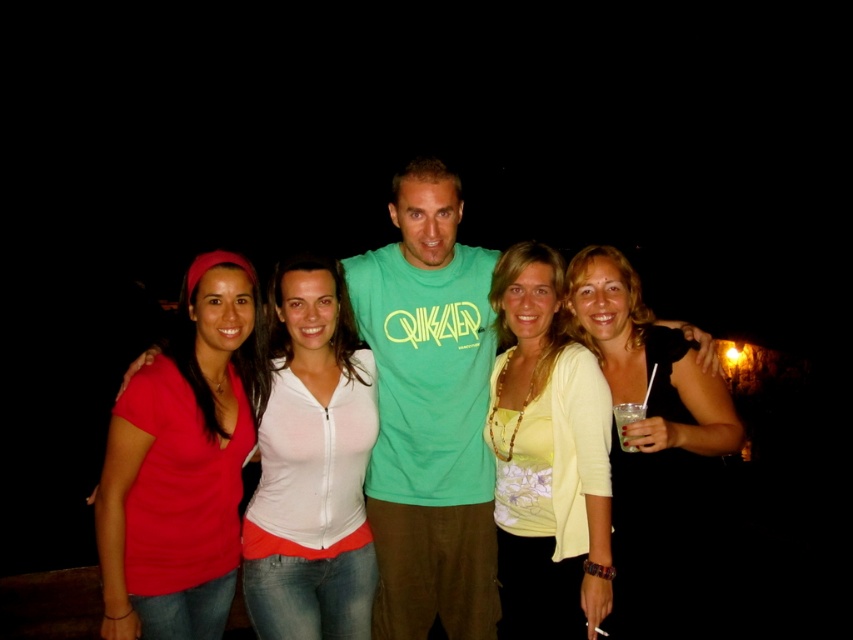
You are a photographer trying to capture a photo of the matte red shirt at center and the black matte dress at right. Since the scene is dark, you need to ensure both subjects are fully visible. Which clothing item should you focus on first to ensure it doesn

The matte red shirt at center is shorter than the black matte dress at right, so focusing on the black matte dress at right first would be better because its greater height might make it more visible in the dark.

You are a photographer at this nighttime gathering. You need to capture a photo that includes both the black matte dress at right and the clear plastic cup at center right. Which object should you ensure is placed closer to the camera to avoid it appearing too small in the photo?

The clear plastic cup at center right should be placed closer to the camera because it is smaller than the black matte dress at right, so positioning it nearer will help it appear more visible in the photo.